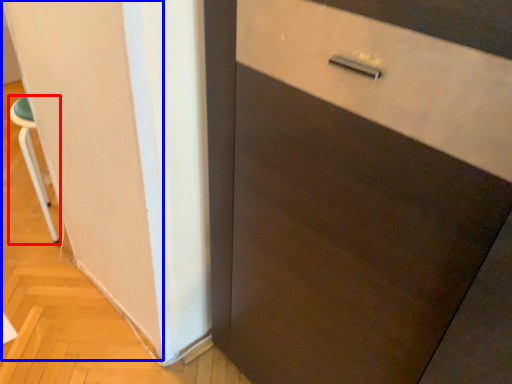
Question: Which point is closer to the camera, furniture (highlighted by a red box) or barn door (highlighted by a blue box)?

Choices:
 (A) furniture
 (B) barn door

Answer: (B)